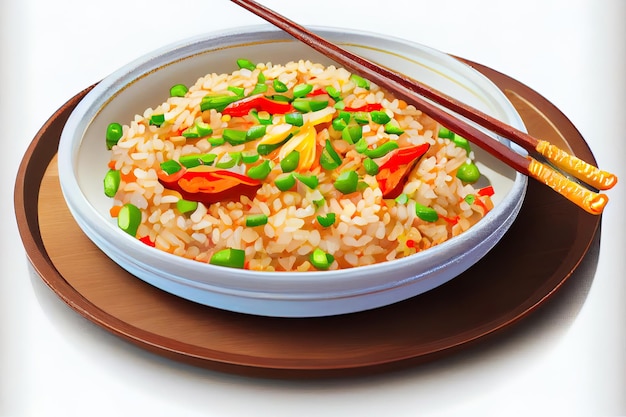
Image resolution: width=626 pixels, height=417 pixels. I want to click on chopsticks, so click(x=570, y=163), click(x=578, y=196).